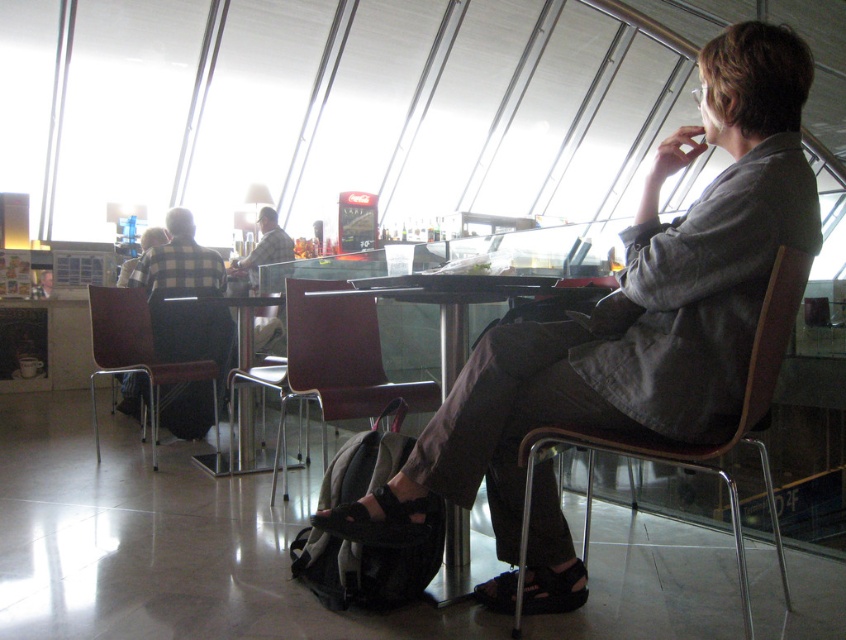
Question: Among these points, which one is farthest from the camera?

Choices:
 (A) (163, 342)
 (B) (378, 413)

Answer: (A)

Question: Can you confirm if checkered fabric shirt at left is bigger than brown leather chair at left?

Choices:
 (A) no
 (B) yes

Answer: (B)

Question: Can you confirm if brown leather chair at right is positioned below checkered fabric shirt at left?

Choices:
 (A) yes
 (B) no

Answer: (A)

Question: Estimate the real-world distances between objects in this image. Which object is closer to the brown leather chair at center?

Choices:
 (A) black plastic table at center
 (B) brown leather chair at left
 (C) matte gray shirt at center

Answer: (A)

Question: Which point is farther to the camera?

Choices:
 (A) matte gray shirt at center
 (B) brown leather chair at center
 (C) black plastic table at center

Answer: (C)

Question: Can you confirm if brown leather chair at center is smaller than checkered fabric shirt at left?

Choices:
 (A) no
 (B) yes

Answer: (B)